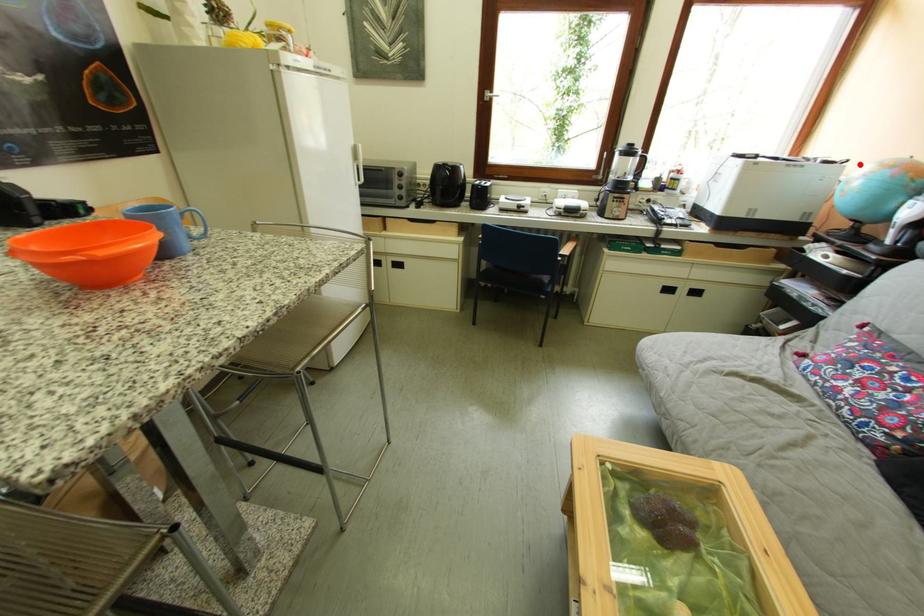
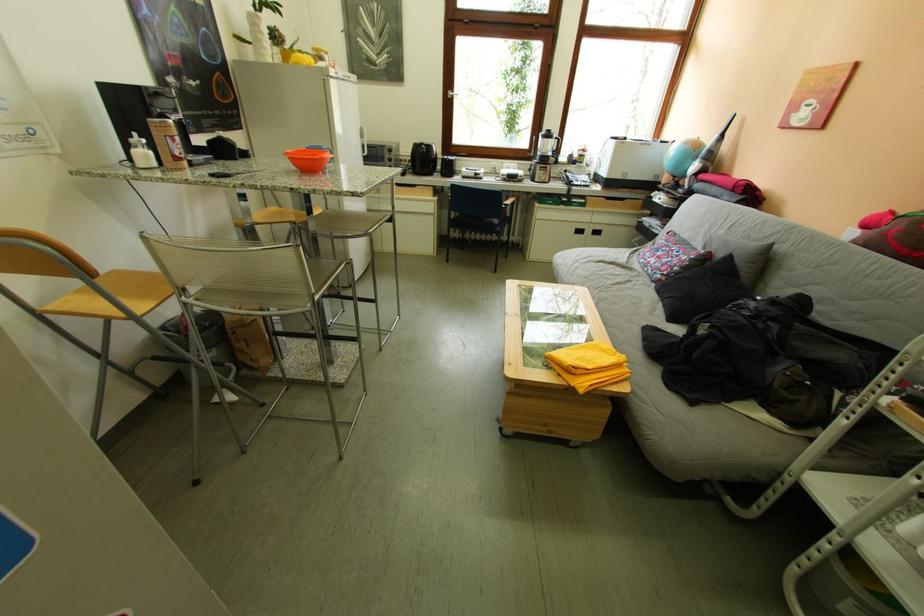
The point at the highlighted location is marked in the first image. Where is the corresponding point in the second image?

(687, 145)